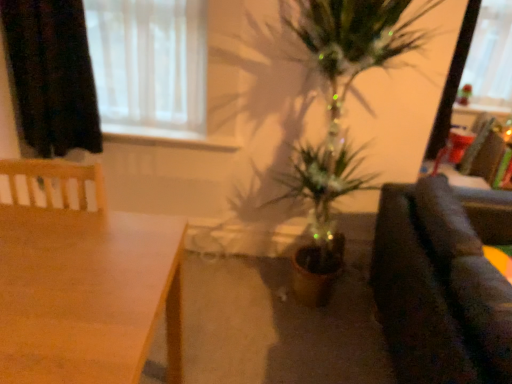
You are a GUI agent. You are given a task and a screenshot of the screen. Output one action in this format:
    pyautogui.click(x=<x>, y=<y>)
    Task: Click on the vacant space situated above wooden table at lower left (from a real-world perspective)
    This screenshot has width=512, height=384.
    Given the screenshot: What is the action you would take?
    pyautogui.click(x=83, y=278)